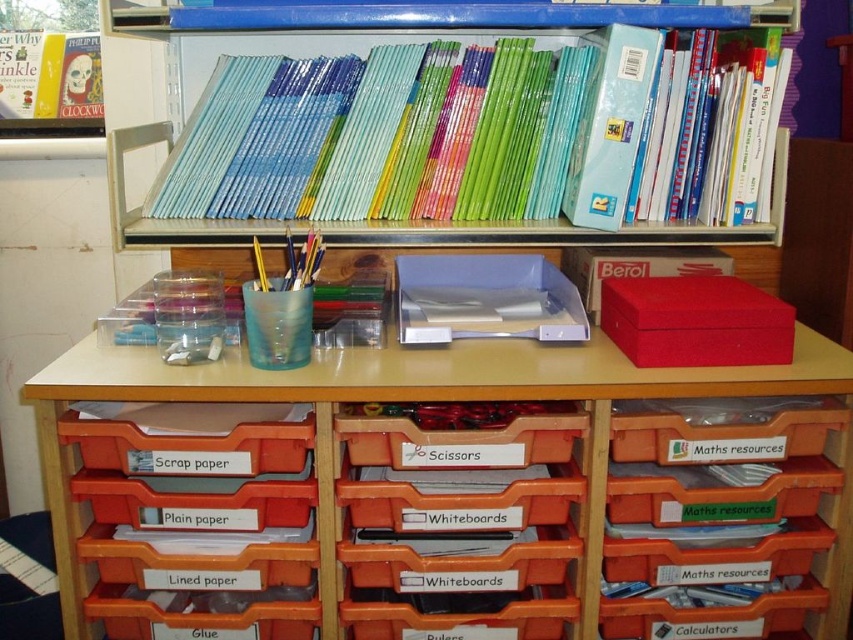
You are a student who needs to place a new textbook on the desk. You see the matte plastic table at center and the hardcover book at upper left. Which object should you place the textbook on to ensure it is visible from the front of the desk?

The matte plastic table at center is in front of the hardcover book at upper left, so placing the textbook on the matte plastic table at center will make it more visible from the front of the desk.

You are a student who needs to place a textbook on the desk. The textbook is too heavy to hold. You see the matte plastic table at center and the hardcover book at upper left. Which object can you place the textbook on?

The matte plastic table at center is below the hardcover book at upper left, so the textbook should be placed on the matte plastic table at center since it is a flat surface suitable for holding heavy items.